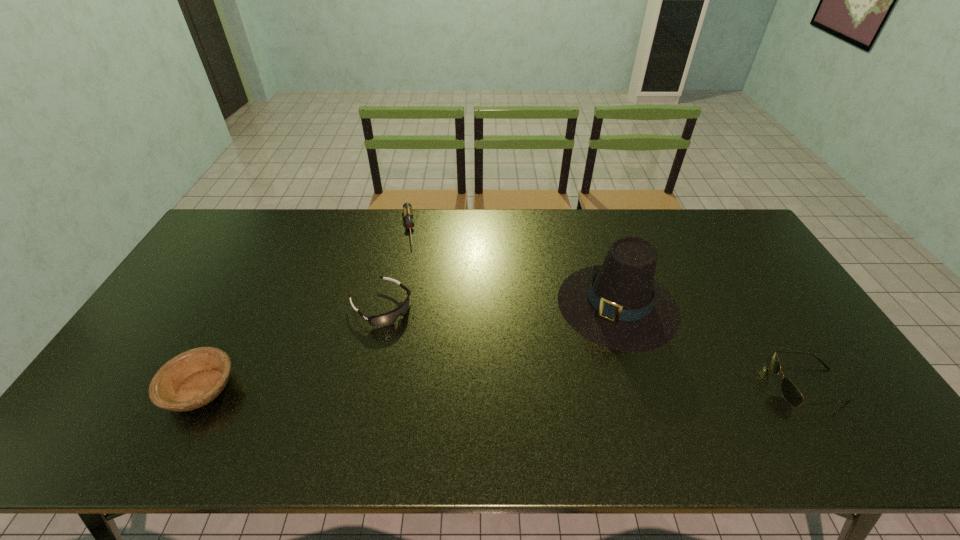
Identify the location of free region located on the front-facing side of the sunglasses. (718, 385).

You are a GUI agent. You are given a task and a screenshot of the screen. Output one action in this format:
    pyautogui.click(x=<x>, y=<y>)
    Task: Click on the free region located on the front and sides of the goggles
    The height and width of the screenshot is (540, 960).
    Given the screenshot: What is the action you would take?
    click(x=483, y=391)

This screenshot has width=960, height=540. Identify the location of free space located on the front and sides of the goggles. (441, 355).

The height and width of the screenshot is (540, 960). What are the coordinates of `free region located on the front and sides of the goggles` in the screenshot? It's located at (445, 359).

This screenshot has height=540, width=960. What are the coordinates of `vacant space located insert the shortest object into a screw head` in the screenshot? It's located at (411, 298).

The width and height of the screenshot is (960, 540). Identify the location of vacant space located 0.290m insert the shortest object into a screw head. (413, 310).

Where is `vacant space positioned insert the shortest object into a screw head`? vacant space positioned insert the shortest object into a screw head is located at coordinates (408, 272).

At what (x,y) coordinates should I click in order to perform the action: click on vacant space located on the front-facing side of the tallest object. Please return your answer as a coordinate pair (x, y). Looking at the image, I should click on (525, 407).

Find the location of `free spot located 0.080m on the front-facing side of the tallest object`. free spot located 0.080m on the front-facing side of the tallest object is located at coordinates (570, 357).

You are a GUI agent. You are given a task and a screenshot of the screen. Output one action in this format:
    pyautogui.click(x=<x>, y=<y>)
    Task: Click on the vacant space located on the front-facing side of the tallest object
    
    Given the screenshot: What is the action you would take?
    pyautogui.click(x=544, y=386)